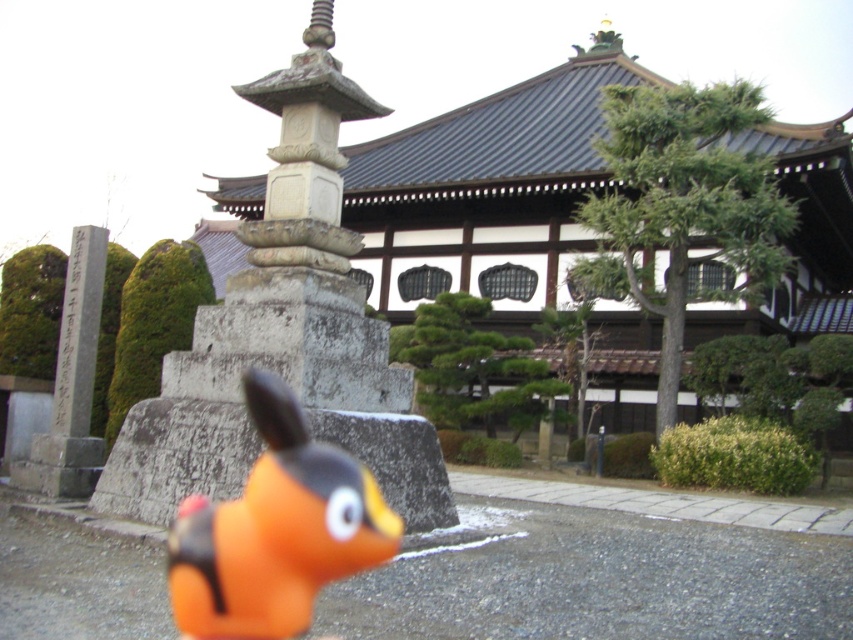
Question: Does orange matte toy at center appear over gray stone monument at left?

Choices:
 (A) yes
 (B) no

Answer: (B)

Question: Does orange matte toy at center have a larger size compared to gray stone monument at left?

Choices:
 (A) no
 (B) yes

Answer: (A)

Question: Among these points, which one is nearest to the camera?

Choices:
 (A) (68, 344)
 (B) (299, 481)

Answer: (B)

Question: Among these objects, which one is farthest from the camera?

Choices:
 (A) orange matte toy at center
 (B) gray stone monument at left

Answer: (B)

Question: Can you confirm if orange matte toy at center is smaller than gray stone monument at left?

Choices:
 (A) yes
 (B) no

Answer: (A)